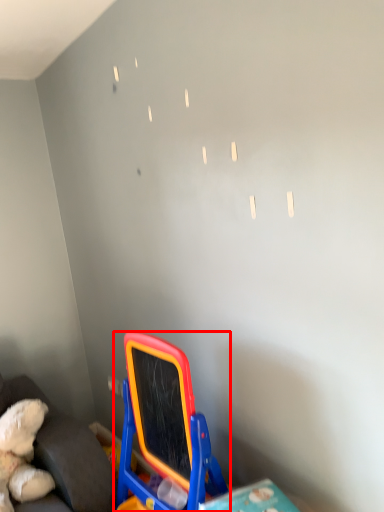
Question: Observing the image, what is the correct spatial positioning of toy (annotated by the red box) in reference to furniture?

Choices:
 (A) left
 (B) right

Answer: (B)